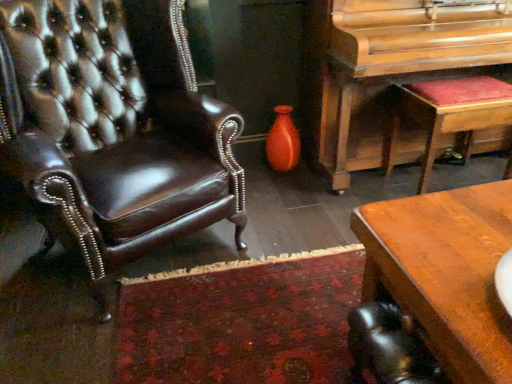
Image resolution: width=512 pixels, height=384 pixels. Find the location of `velvet red stool at right`. velvet red stool at right is located at coordinates (449, 113).

The image size is (512, 384). What do you see at coordinates (114, 127) in the screenshot?
I see `brown leather chair at left` at bounding box center [114, 127].

What do you see at coordinates (390, 67) in the screenshot?
I see `wooden polished piano at right` at bounding box center [390, 67].

What is the approximate height of brown wooden desk at lower right?

The height of brown wooden desk at lower right is 12.80 inches.

Locate an element on the screen. Image resolution: width=512 pixels, height=384 pixels. matte orange vase at center is located at coordinates (283, 141).

Measure the distance between point (272, 129) and camera.

Point (272, 129) and camera are 7.71 feet apart from each other.

Where is `velvet red stool at right`? Image resolution: width=512 pixels, height=384 pixels. velvet red stool at right is located at coordinates (449, 113).

From the image's perspective, between brown leather chair at left and matte orange vase at center, which one is located above?

matte orange vase at center.

Based on the photo, which object is further away from the camera taking this photo, brown leather chair at left or matte orange vase at center?

Positioned behind is matte orange vase at center.

Does brown leather chair at left have a smaller size compared to matte orange vase at center?

Incorrect, brown leather chair at left is not smaller in size than matte orange vase at center.

Can you tell me how much brown leather chair at left and matte orange vase at center differ in facing direction?

28.9 degrees separate the facing orientations of brown leather chair at left and matte orange vase at center.

What's the angular difference between brown leather chair at left and brown wooden desk at lower right's facing directions?

The angle between the facing direction of brown leather chair at left and the facing direction of brown wooden desk at lower right is 117 degrees.

Is brown wooden desk at lower right located within brown leather chair at left?

No.

From a real-world perspective, between brown leather chair at left and brown wooden desk at lower right, who is vertically lower?

brown wooden desk at lower right is physically lower.

In the scene shown: Can you confirm if brown leather chair at left is thinner than brown wooden desk at lower right?

In fact, brown leather chair at left might be wider than brown wooden desk at lower right.

Is brown wooden desk at lower right next to wooden polished piano at right?

brown wooden desk at lower right is not next to wooden polished piano at right, and they're not touching.

Considering the positions of objects brown wooden desk at lower right and wooden polished piano at right in the image provided, who is more to the left, brown wooden desk at lower right or wooden polished piano at right?

Positioned to the left is brown wooden desk at lower right.

From a real-world perspective, is brown wooden desk at lower right physically below wooden polished piano at right?

Yes.

Identify the location of piano above the brown wooden desk at lower right (from the image's perspective). (390, 67).

Consider the image. Does matte orange vase at center come behind velvet red stool at right?

Yes, it is behind velvet red stool at right.

From a real-world perspective, is matte orange vase at center located higher than velvet red stool at right?

No, from a real-world perspective, matte orange vase at center is not above velvet red stool at right.

Is matte orange vase at center oriented away from velvet red stool at right?

No, velvet red stool at right is not at the back of matte orange vase at center.

Do you think velvet red stool at right is within brown wooden desk at lower right, or outside of it?

velvet red stool at right cannot be found inside brown wooden desk at lower right.

Can you confirm if velvet red stool at right is smaller than brown wooden desk at lower right?

Incorrect, velvet red stool at right is not smaller in size than brown wooden desk at lower right.

Could you tell me if velvet red stool at right is turned towards brown wooden desk at lower right?

No, velvet red stool at right is not aimed at brown wooden desk at lower right.

Is velvet red stool at right to the right of matte orange vase at center from the viewer's perspective?

Correct, you'll find velvet red stool at right to the right of matte orange vase at center.

In the scene shown: From a real-world perspective, who is located lower, velvet red stool at right or matte orange vase at center?

matte orange vase at center, from a real-world perspective.

Does point (420, 104) appear closer or farther from the camera than point (275, 134)?

Point (420, 104).

Is velvet red stool at right aimed at matte orange vase at center?

No, velvet red stool at right is not turned towards matte orange vase at center.

Between point (323, 126) and point (486, 274), which one is positioned in front?

Positioned in front is point (486, 274).

Between wooden polished piano at right and brown wooden desk at lower right, which one appears on the right side from the viewer's perspective?

From the viewer's perspective, wooden polished piano at right appears more on the right side.

What's the angular difference between wooden polished piano at right and brown wooden desk at lower right's facing directions?

There is a 88.2-degree angle between the facing directions of wooden polished piano at right and brown wooden desk at lower right.

Is wooden polished piano at right placed right next to brown wooden desk at lower right?

wooden polished piano at right and brown wooden desk at lower right are not in contact.

The image size is (512, 384). In the image, there is a brown leather chair at left. Identify the location of vase above it (from the image's perspective). (283, 141).

Locate an element on the screen. The height and width of the screenshot is (384, 512). chair above the brown wooden desk at lower right (from a real-world perspective) is located at coordinates (114, 127).

Looking at the image, which one is located closer to wooden polished piano at right, matte orange vase at center or brown wooden desk at lower right?

matte orange vase at center lies closer to wooden polished piano at right than the other object.

When comparing their distances from velvet red stool at right, does brown leather chair at left or wooden polished piano at right seem closer?

wooden polished piano at right is positioned closer to the anchor velvet red stool at right.

Considering their positions, is matte orange vase at center positioned further to brown wooden desk at lower right than wooden polished piano at right?

Based on the image, matte orange vase at center appears to be further to brown wooden desk at lower right.

Considering their positions, is brown leather chair at left positioned further to brown wooden desk at lower right than wooden polished piano at right?

wooden polished piano at right is positioned further to the anchor brown wooden desk at lower right.

When comparing their distances from matte orange vase at center, does wooden polished piano at right or brown wooden desk at lower right seem further?

Based on the image, brown wooden desk at lower right appears to be further to matte orange vase at center.

Estimate the real-world distances between objects in this image. Which object is further from wooden polished piano at right, brown leather chair at left or velvet red stool at right?

brown leather chair at left is further to wooden polished piano at right.

Based on their spatial positions, is brown wooden desk at lower right or velvet red stool at right closer to wooden polished piano at right?

velvet red stool at right.

From the image, which object appears to be farther from brown leather chair at left, matte orange vase at center or wooden polished piano at right?

matte orange vase at center lies further to brown leather chair at left than the other object.

What are the coordinates of `stool between wooden polished piano at right and brown wooden desk at lower right vertically` in the screenshot? It's located at (449, 113).

Find the location of a particular element. The height and width of the screenshot is (384, 512). desk between brown leather chair at left and wooden polished piano at right from left to right is located at coordinates (445, 273).

Find the location of a particular element. The width and height of the screenshot is (512, 384). piano between brown wooden desk at lower right and matte orange vase at center along the z-axis is located at coordinates (390, 67).

Where is `stool located between brown leather chair at left and wooden polished piano at right in the left-right direction`? This screenshot has width=512, height=384. stool located between brown leather chair at left and wooden polished piano at right in the left-right direction is located at coordinates (449, 113).